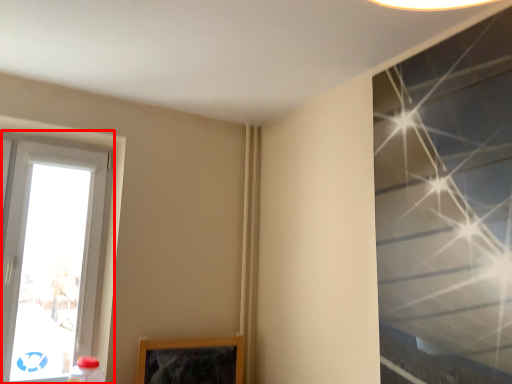
Question: From the image's perspective, considering the relative positions of window (annotated by the red box) and window in the image provided, where is window (annotated by the red box) located with respect to the staircase?

Choices:
 (A) below
 (B) above

Answer: (A)